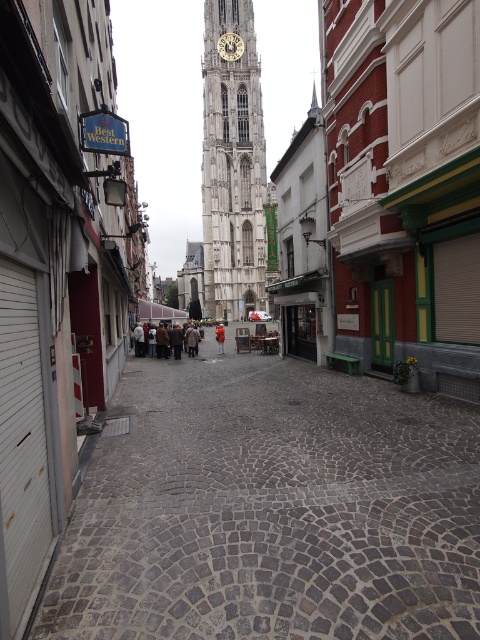
You are standing on the cobblestone street and want to walk towards the Gothic tower. There are two points marked on the map at coordinates point (157, 344) and point (219, 344). Which point should you step on first to stay on the path leading directly to the tower?

You should step on point (157, 344) first because it is in front of point (219, 344) along the path leading to the Gothic tower.

You are standing at point (105, 129) and want to walk to the large ornate Gothic tower in the background. The path is 52.65 meters long. If you walk at a speed of 1.5 meters per second, how many seconds will it take you to reach the tower?

The distance to the tower is 52.65 meters, and walking at 1.5 meters per second, it will take 52.65 divided by 1.5 equals approximately 35.1 seconds to reach the tower.